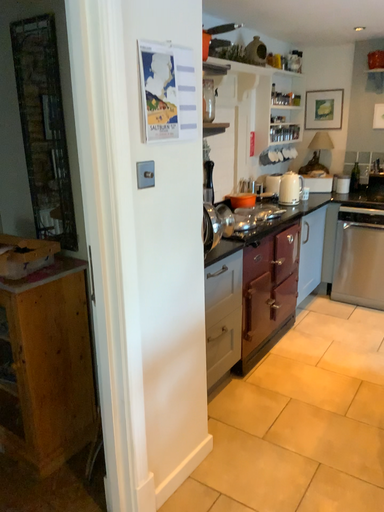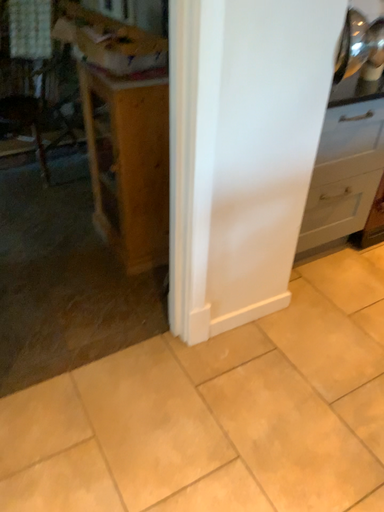
Question: Which way did the camera rotate in the video?

Choices:
 (A) rotated right
 (B) rotated left

Answer: (B)